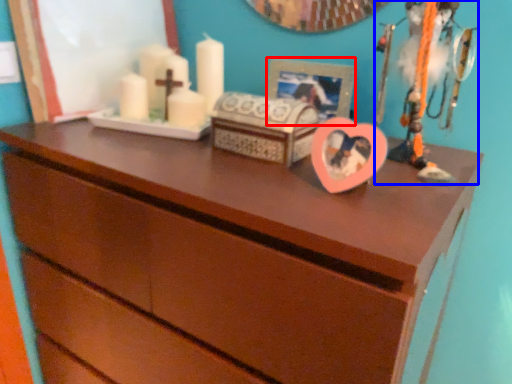
Question: Which object is further to the camera taking this photo, picture frame (highlighted by a red box) or toy (highlighted by a blue box)?

Choices:
 (A) picture frame
 (B) toy

Answer: (A)